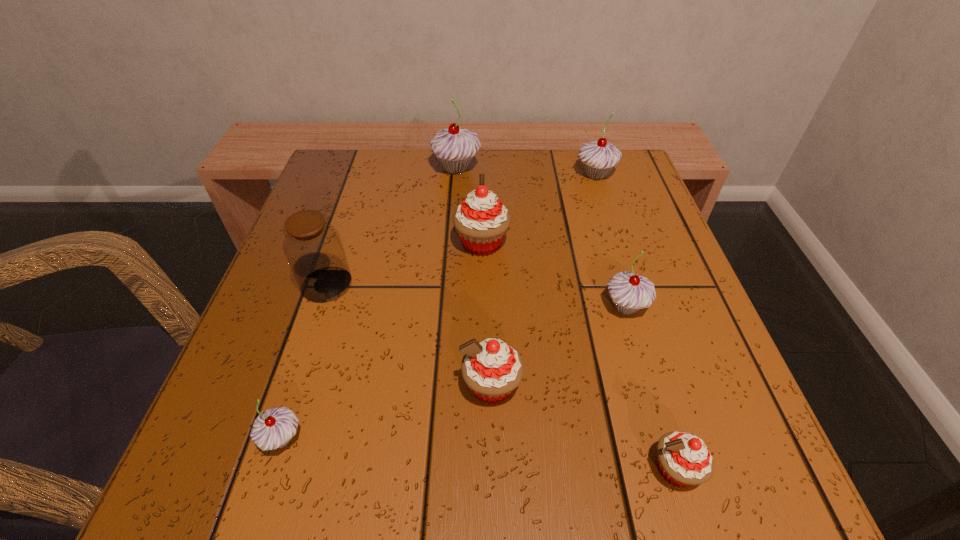
I want to click on vacant area at the right edge of the desktop, so 666,368.

In the image, there is a desktop. At what (x,y) coordinates should I click in order to perform the action: click on vacant space at the far left corner. Please return your answer as a coordinate pair (x, y). Looking at the image, I should click on (349, 184).

You are a GUI agent. You are given a task and a screenshot of the screen. Output one action in this format:
    pyautogui.click(x=<x>, y=<y>)
    Task: Click on the blank region between the second biggest pink cupcake and the nearest gray cupcake
    
    Given the screenshot: What is the action you would take?
    pyautogui.click(x=387, y=412)

I want to click on free area in between the second nearest gray cupcake and the third smallest gray cupcake, so click(611, 241).

Find the location of a particular element. This screenshot has height=540, width=960. free point between the sixth nearest object and the smallest gray cupcake is located at coordinates (382, 341).

In order to click on empty location between the leftmost cupcake and the tallest object in this screenshot , I will do `click(369, 303)`.

Identify the location of vacant area that lies between the third nearest object and the fourth farthest cupcake. (559, 347).

This screenshot has height=540, width=960. In order to click on unoccupied area between the smallest pink cupcake and the fourth nearest cupcake in this screenshot , I will do `click(650, 388)`.

Find the location of a particular element. Image resolution: width=960 pixels, height=540 pixels. vacant region between the smallest pink cupcake and the tallest object is located at coordinates (565, 319).

What are the coordinates of `vacant region between the second biggest gray cupcake and the fifth farthest cupcake` in the screenshot? It's located at (543, 280).